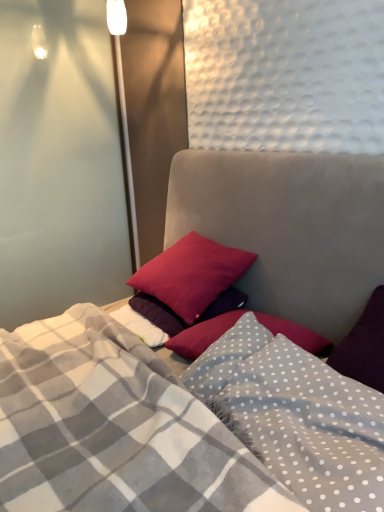
Question: Can you confirm if transparent glass door at left is wider than matte red pillow at center, arranged as the second pillow when ordered from the bottom?

Choices:
 (A) yes
 (B) no

Answer: (A)

Question: Is transparent glass door at left positioned in front of matte red pillow at center, which is the 1th pillow from top to bottom?

Choices:
 (A) no
 (B) yes

Answer: (A)

Question: Does transparent glass door at left have a lesser width compared to matte red pillow at center, which is the 1th pillow from top to bottom?

Choices:
 (A) no
 (B) yes

Answer: (A)

Question: Can you confirm if transparent glass door at left is shorter than matte red pillow at center, arranged as the second pillow when ordered from the bottom?

Choices:
 (A) no
 (B) yes

Answer: (A)

Question: Does transparent glass door at left turn towards matte red pillow at center, arranged as the second pillow when ordered from the bottom?

Choices:
 (A) no
 (B) yes

Answer: (B)

Question: Is transparent glass door at left next to matte red pillow at center, which is the 1th pillow from top to bottom, and touching it?

Choices:
 (A) yes
 (B) no

Answer: (B)

Question: Is gray polka dot blanket at center to the right of matte red pillow at center, which is the 1th pillow from top to bottom, from the viewer's perspective?

Choices:
 (A) yes
 (B) no

Answer: (A)

Question: Does gray polka dot blanket at center have a lesser height compared to matte red pillow at center, which is the 1th pillow from top to bottom?

Choices:
 (A) no
 (B) yes

Answer: (B)

Question: Is matte red pillow at center, which is the 1th pillow from top to bottom, surrounded by gray polka dot blanket at center?

Choices:
 (A) no
 (B) yes

Answer: (A)

Question: Is there a large distance between gray polka dot blanket at center and matte red pillow at center, arranged as the second pillow when ordered from the bottom?

Choices:
 (A) yes
 (B) no

Answer: (B)

Question: From a real-world perspective, is gray polka dot blanket at center located higher than matte red pillow at center, arranged as the second pillow when ordered from the bottom?

Choices:
 (A) no
 (B) yes

Answer: (A)

Question: Is gray polka dot blanket at center to the left of matte red pillow at center, which is the 1th pillow from top to bottom, from the viewer's perspective?

Choices:
 (A) no
 (B) yes

Answer: (A)

Question: Considering the relative sizes of matte red pillow at center, which is the 1th pillow from top to bottom, and velvet-like pillows at center in the image provided, is matte red pillow at center, which is the 1th pillow from top to bottom, smaller than velvet-like pillows at center?

Choices:
 (A) no
 (B) yes

Answer: (B)